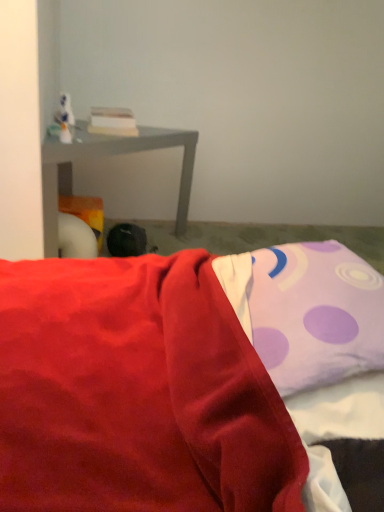
Question: Is purple dotted pillow at upper right bigger or smaller than black fabric bean bag at center?

Choices:
 (A) big
 (B) small

Answer: (A)

Question: Is purple dotted pillow at upper right in front of or behind black fabric bean bag at center in the image?

Choices:
 (A) front
 (B) behind

Answer: (A)

Question: Which is nearer to the purple dotted pillow at upper right?

Choices:
 (A) matte gray table at left
 (B) black fabric bean bag at center

Answer: (B)

Question: Estimate the real-world distances between objects in this image. Which object is closer to the matte gray table at left?

Choices:
 (A) purple dotted pillow at upper right
 (B) black fabric bean bag at center

Answer: (B)